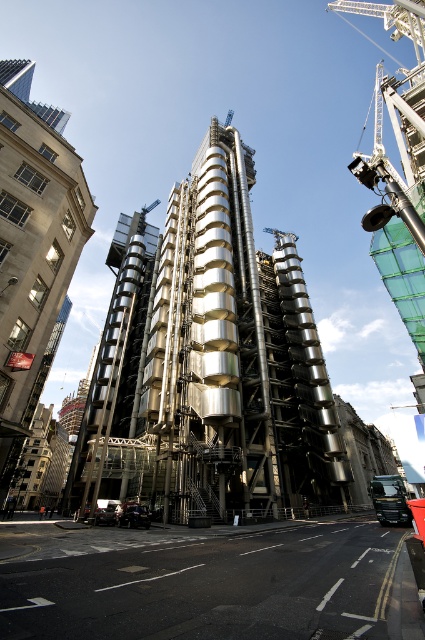
Question: Which point appears closest to the camera in this image?

Choices:
 (A) (50, 220)
 (B) (176, 225)

Answer: (A)

Question: In this image, where is metallic silver tower at center located relative to silver metallic building at left?

Choices:
 (A) left
 (B) right

Answer: (B)

Question: Which object is closer to the camera taking this photo?

Choices:
 (A) silver metallic building at left
 (B) metallic silver tower at center

Answer: (A)

Question: Does metallic silver tower at center come behind silver metallic building at left?

Choices:
 (A) no
 (B) yes

Answer: (B)

Question: Is metallic silver tower at center to the left of silver metallic building at left from the viewer's perspective?

Choices:
 (A) yes
 (B) no

Answer: (B)